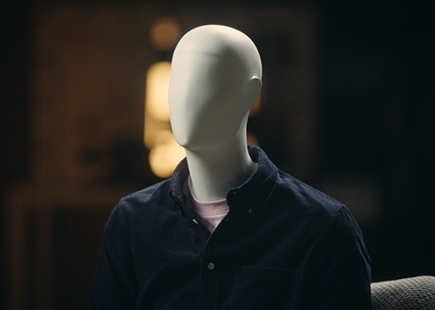
I want to click on mannequin, so click(203, 124).